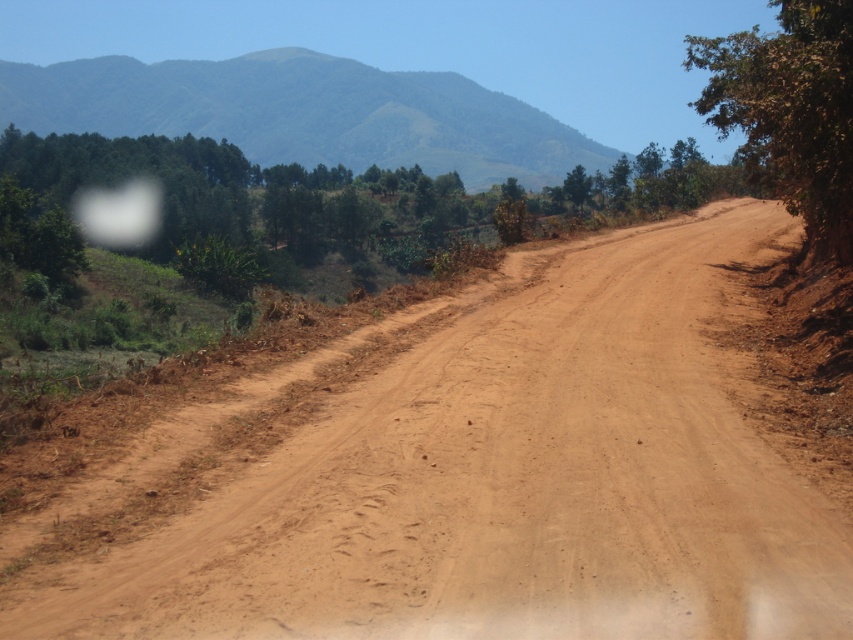
Is green textured hill at upper center wider than brown rough tree at right?

Correct, the width of green textured hill at upper center exceeds that of brown rough tree at right.

Looking at this image, who is taller, green textured hill at upper center or brown rough tree at right?

With more height is brown rough tree at right.

Locate an element on the screen. This screenshot has height=640, width=853. green textured hill at upper center is located at coordinates (305, 113).

Where is `green textured hill at upper center`? green textured hill at upper center is located at coordinates (305, 113).

Which is more to the right, brown dirt road at center or green textured hill at upper center?

brown dirt road at center is more to the right.

Who is taller, brown dirt road at center or green textured hill at upper center?

With more height is green textured hill at upper center.

Which is in front, point (364, 602) or point (45, 112)?

Point (364, 602) is in front.

This screenshot has height=640, width=853. Find the location of `brown dirt road at center`. brown dirt road at center is located at coordinates (508, 484).

Is the position of brown dirt road at center more distant than that of brown rough tree at right?

That is False.

Is point (355, 580) positioned after point (788, 108)?

No, (355, 580) is closer to viewer.

This screenshot has height=640, width=853. Describe the element at coordinates (508, 484) in the screenshot. I see `brown dirt road at center` at that location.

Image resolution: width=853 pixels, height=640 pixels. Identify the location of brown dirt road at center. (508, 484).